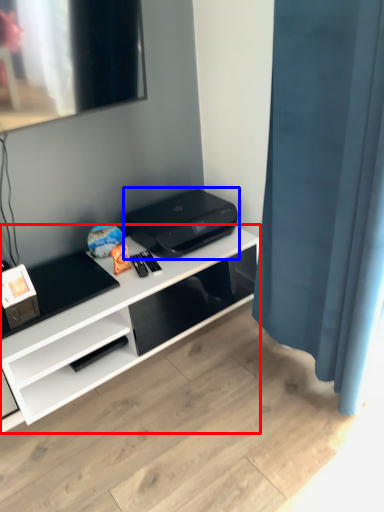
Question: Which point is closer to the camera, desk (highlighted by a red box) or printer (highlighted by a blue box)?

Choices:
 (A) desk
 (B) printer

Answer: (A)